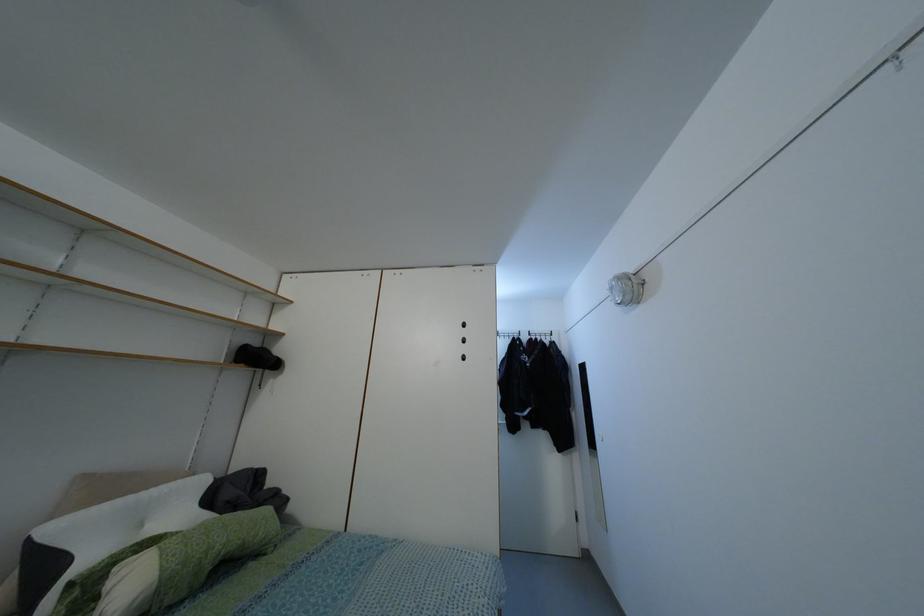
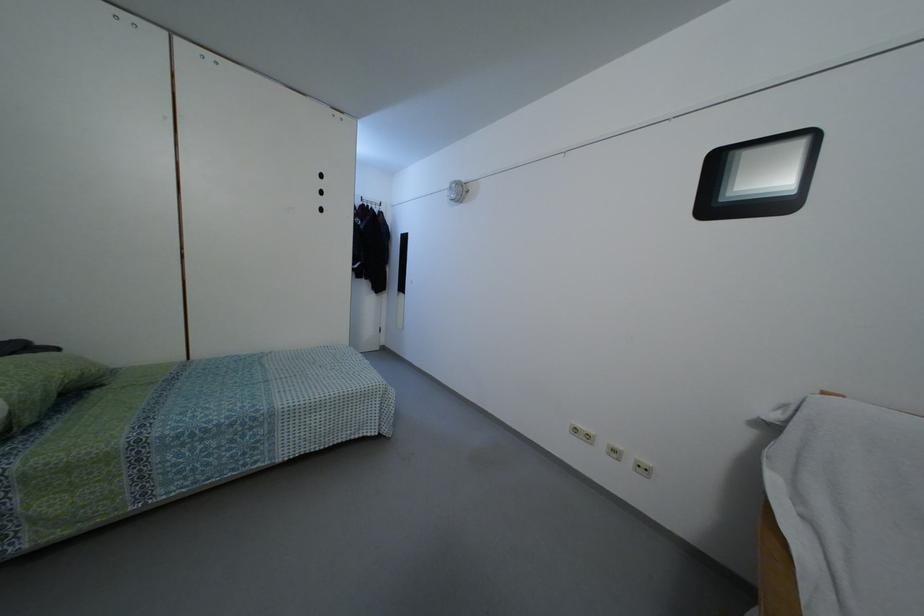
The point at (265, 509) is marked in the first image. Where is the corresponding point in the second image?

(52, 354)